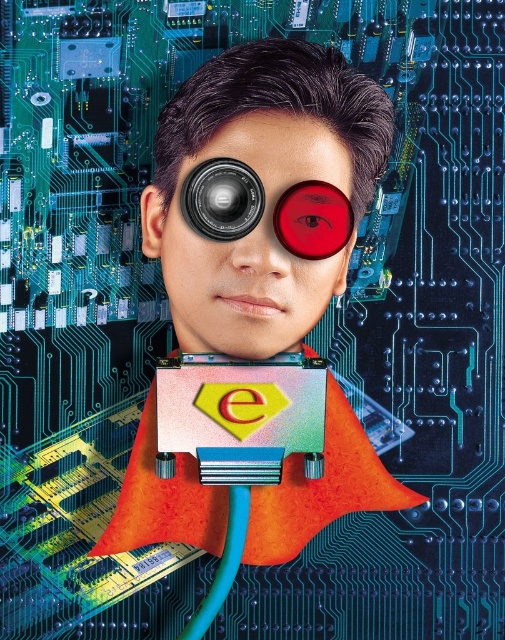
You are standing in front of a digital art installation that displays the scene described. The installation has a touch interface where you can place a small sensor at any point. If you place the sensor at point (280, 154), how far will it be from you in centimeters?

The distance between point (280, 154) and the viewer is 63.50 centimeters, so placing the sensor there would result in a distance of 63.50 centimeters from you.

Based on the description, which object is taller between the metallic circuit board at center and the matte black lens at center?

The metallic circuit board at center is taller than the matte black lens at center according to the description.

You are designing a facial recognition system for a security camera. The system must distinguish between two lenses on a person in the image. The lenses are the matte black lens at center and the black metallic lens at center. How far apart are these two lenses?

The matte black lens at center is 0.61 inches away from the black metallic lens at center.